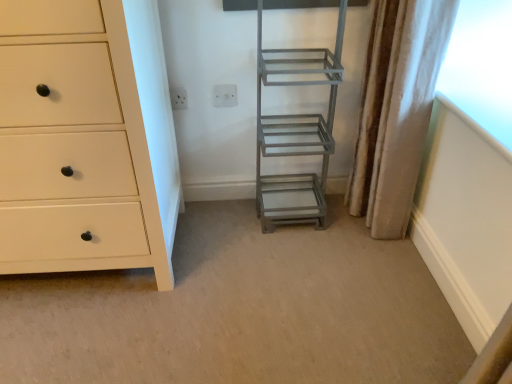
The height and width of the screenshot is (384, 512). I want to click on vacant space in between silky beige curtain at right and white matte chest of drawers at left, so click(258, 235).